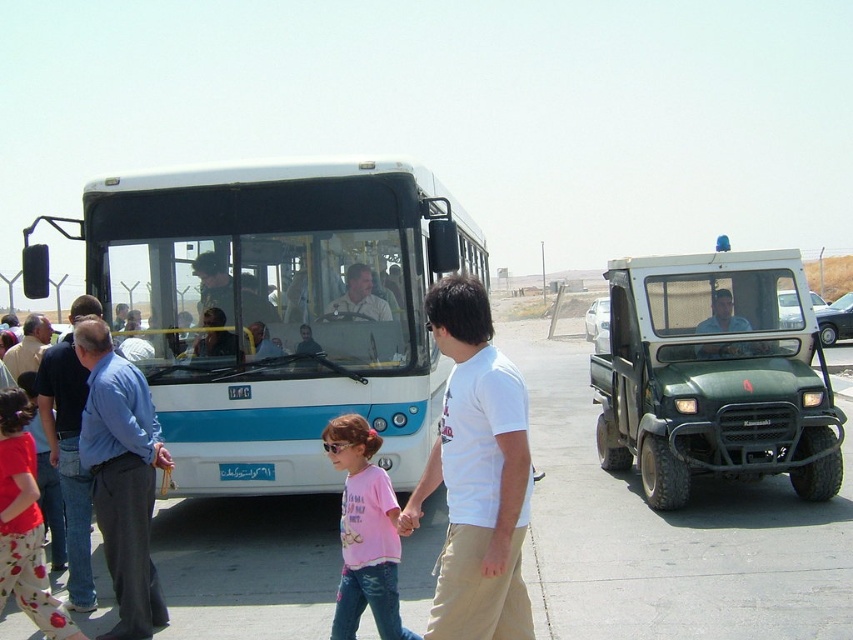
Question: Is matte white shirt at center wider than light blue shirt at center?

Choices:
 (A) yes
 (B) no

Answer: (B)

Question: Which point appears closest to the camera in this image?

Choices:
 (A) (184, 449)
 (B) (376, 317)

Answer: (A)

Question: Which point is closer to the camera?

Choices:
 (A) (485, 596)
 (B) (665, 545)
 (C) (85, 529)
 (D) (714, 310)

Answer: (A)

Question: From the image, what is the correct spatial relationship of green matte utility vehicle at right in relation to blue shirt at left?

Choices:
 (A) above
 (B) below

Answer: (A)

Question: Can you confirm if gray asphalt pavement at center is wider than pink cotton shirt at center?

Choices:
 (A) yes
 (B) no

Answer: (A)

Question: Which point is farther to the camera?

Choices:
 (A) light blue shirt at center
 (B) white cotton t-shirt at center
 (C) white glossy bus at center

Answer: (A)